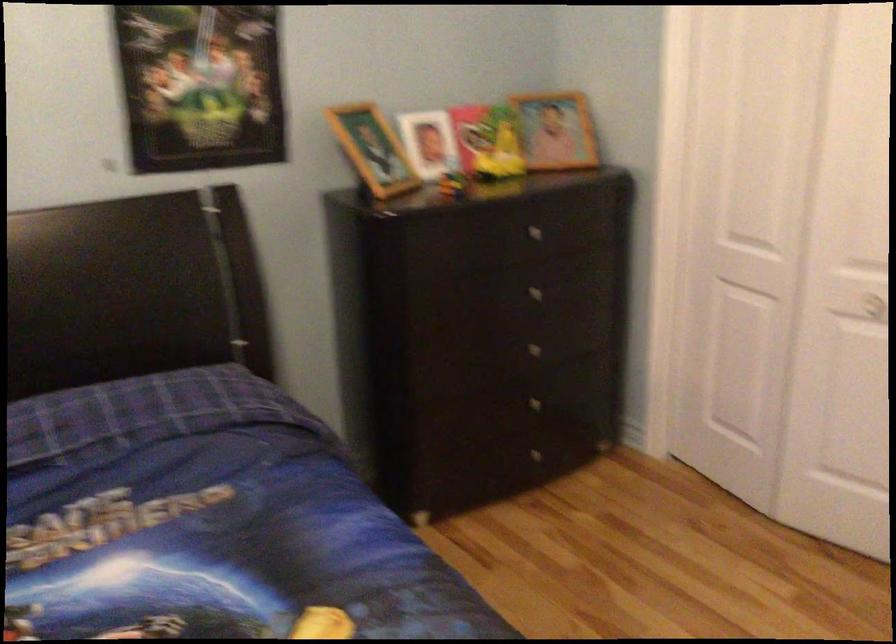
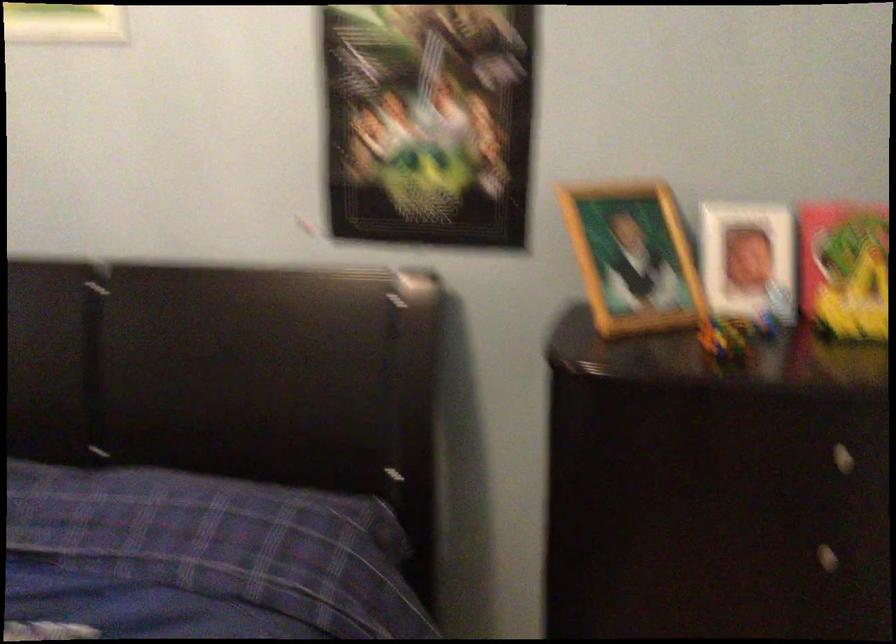
Where in the second image is the point corresponding to [535,234] from the first image?

(840, 458)